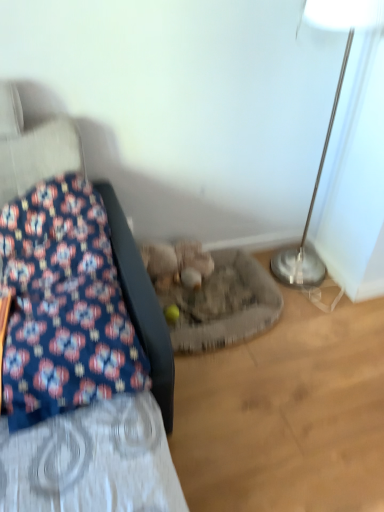
Question: Is silver metallic floor lamp at right completely or partially inside blue floral fabric at left?

Choices:
 (A) yes
 (B) no

Answer: (B)

Question: Is blue floral fabric at left at the left side of silver metallic floor lamp at right?

Choices:
 (A) no
 (B) yes

Answer: (B)

Question: From the image's perspective, would you say blue floral fabric at left is shown under silver metallic floor lamp at right?

Choices:
 (A) no
 (B) yes

Answer: (B)

Question: Is blue floral fabric at left shorter than silver metallic floor lamp at right?

Choices:
 (A) yes
 (B) no

Answer: (A)

Question: Considering the relative sizes of blue floral fabric at left and silver metallic floor lamp at right in the image provided, is blue floral fabric at left smaller than silver metallic floor lamp at right?

Choices:
 (A) yes
 (B) no

Answer: (A)

Question: Is blue floral fabric at left not inside silver metallic floor lamp at right?

Choices:
 (A) yes
 (B) no

Answer: (A)

Question: Would you consider fluffy beige stuffed animal at center to be distant from silver metallic floor lamp at right?

Choices:
 (A) yes
 (B) no

Answer: (B)

Question: Are fluffy beige stuffed animal at center and silver metallic floor lamp at right beside each other?

Choices:
 (A) yes
 (B) no

Answer: (B)

Question: Is fluffy beige stuffed animal at center wider than silver metallic floor lamp at right?

Choices:
 (A) no
 (B) yes

Answer: (A)

Question: Does fluffy beige stuffed animal at center come behind silver metallic floor lamp at right?

Choices:
 (A) no
 (B) yes

Answer: (B)

Question: Is fluffy beige stuffed animal at center closer to the viewer compared to silver metallic floor lamp at right?

Choices:
 (A) yes
 (B) no

Answer: (B)

Question: From a real-world perspective, is fluffy beige stuffed animal at center located higher than silver metallic floor lamp at right?

Choices:
 (A) no
 (B) yes

Answer: (A)

Question: Is fluffy beige stuffed animal at center shorter than blue floral fabric at left?

Choices:
 (A) no
 (B) yes

Answer: (B)